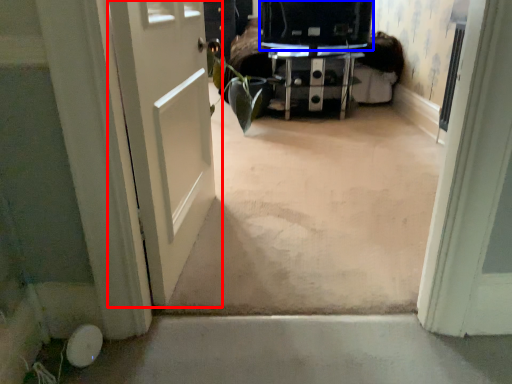
Question: Among these objects, which one is farthest to the camera, door (highlighted by a red box) or back (highlighted by a blue box)?

Choices:
 (A) door
 (B) back

Answer: (B)